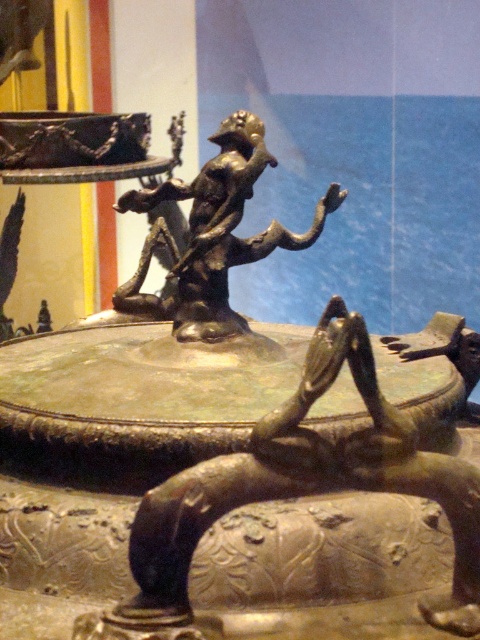
You are a museum curator planning to install a protective glass barrier around the sculpture. The barrier must be placed exactly 1.5 meters away from the sculpture to allow visitors to view it comfortably. Given that the point at coordinates point (192, 516) is part of the sculpture, can you confirm whether the barrier will be positioned safely away from the sculpture?

The point at coordinates point (192, 516) is part of the sculpture, and the barrier is to be placed 1.5 meters away. Since the distance between them is 1.20 meters, the barrier will be too close and not meet the requirement.

You are a visitor at the museum and want to take a photo of the sculpture. You notice two points on the sculpture marked as point 1 at coordinates (86, 632) and point 2 at coordinates (181, 259). Which point is closer to you?

Point 1 at coordinates (86, 632) is closer to the viewer than point 2 at coordinates (181, 259).